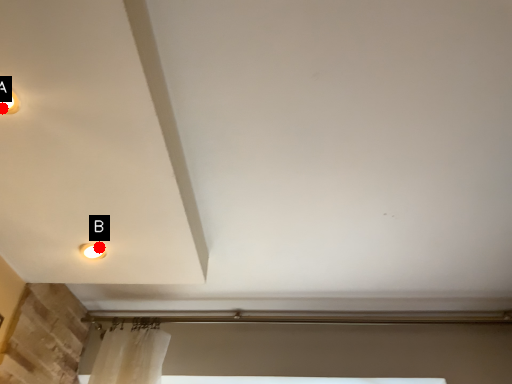
Question: Two points are circled on the image, labeled by A and B beside each circle. Which point appears closest to the camera in this image?

Choices:
 (A) A is closer
 (B) B is closer

Answer: (A)